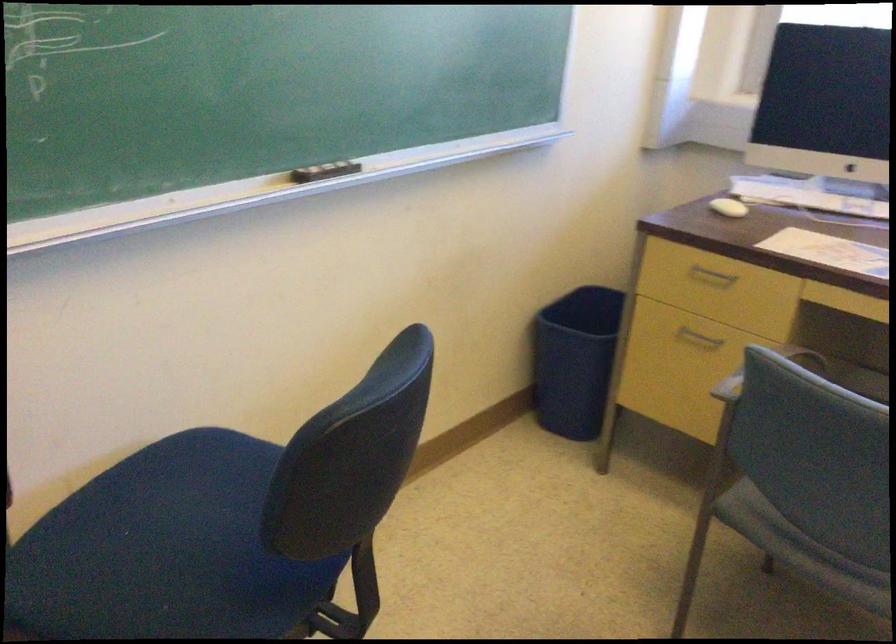
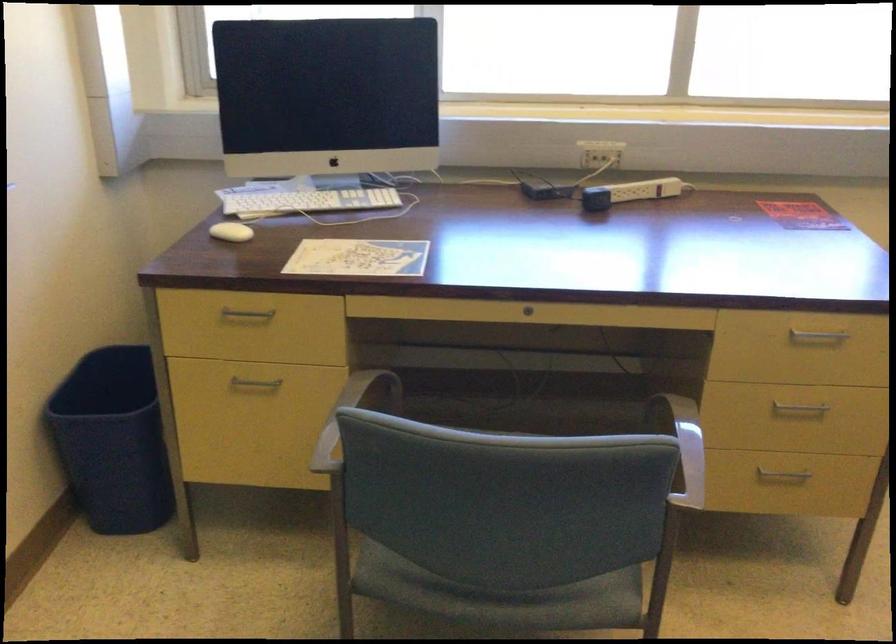
Locate, in the second image, the point that corresponds to pixel 579 348 in the first image.

(113, 440)